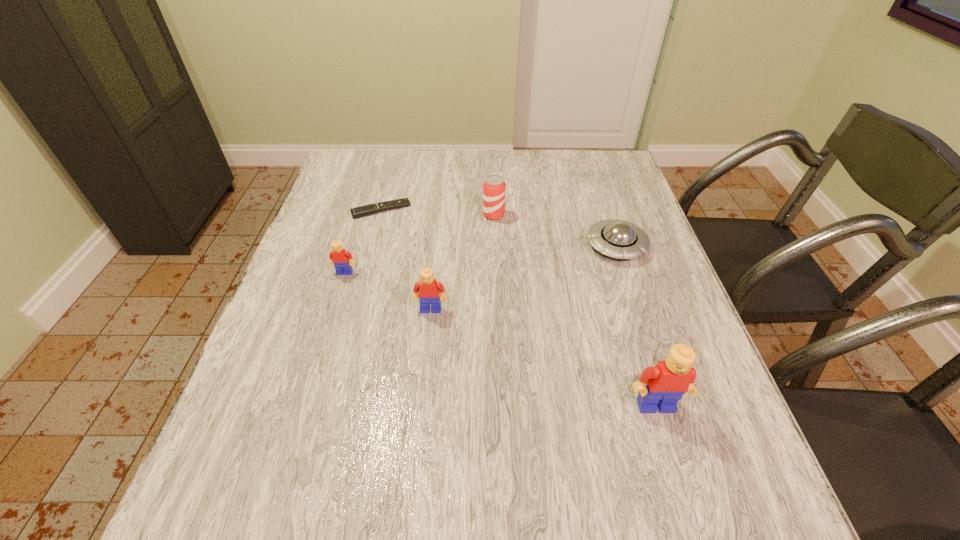
This screenshot has height=540, width=960. Identify the location of the third nearest object. (339, 256).

Where is `the farthest Lego`? Image resolution: width=960 pixels, height=540 pixels. the farthest Lego is located at coordinates (339, 256).

At what (x,y) coordinates should I click in order to perform the action: click on the second nearest Lego. Please return your answer as a coordinate pair (x, y). The image size is (960, 540). Looking at the image, I should click on (x=427, y=291).

Where is `the second nearest object`? This screenshot has width=960, height=540. the second nearest object is located at coordinates (427, 291).

The height and width of the screenshot is (540, 960). I want to click on the nearest object, so click(x=661, y=387).

At what (x,y) coordinates should I click in order to perform the action: click on the rightmost Lego. Please return your answer as a coordinate pair (x, y). This screenshot has height=540, width=960. Looking at the image, I should click on (661, 387).

Identify the location of saucer. The image size is (960, 540). (620, 239).

Identify the location of the second shortest object. (620, 239).

The image size is (960, 540). In order to click on remote control in this screenshot , I will do `click(357, 212)`.

This screenshot has width=960, height=540. Find the location of `beer can`. beer can is located at coordinates point(494,188).